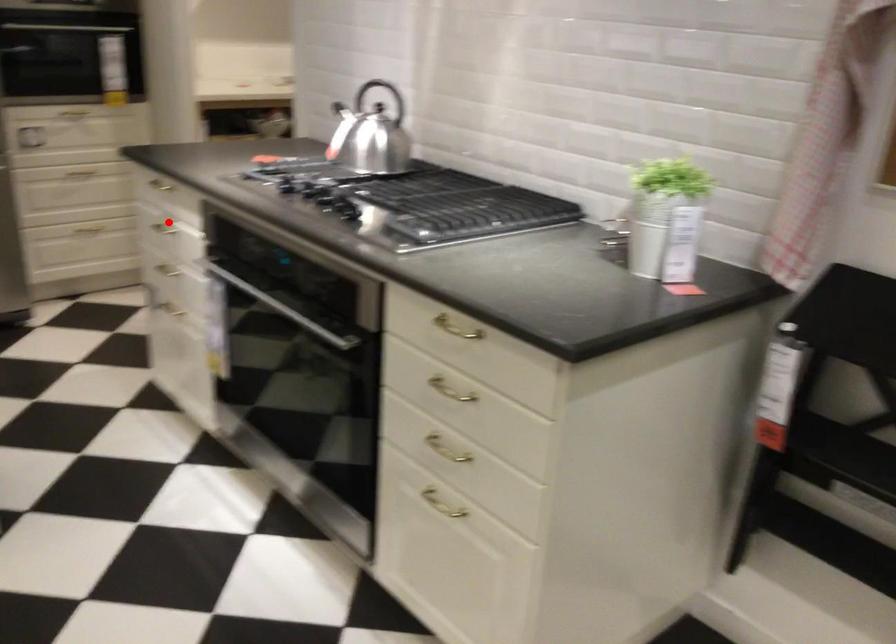
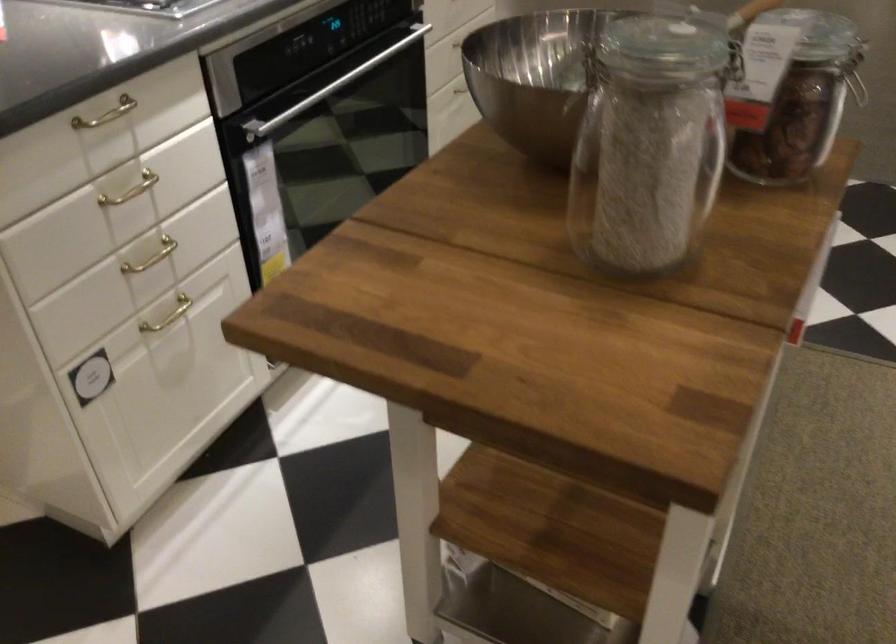
Where in the second image is the point corresponding to the highlighted location from the first image?

(131, 190)